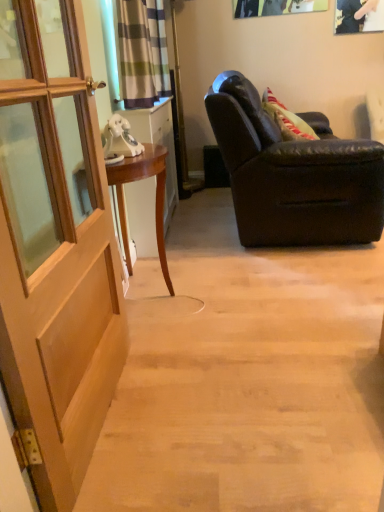
I want to click on vacant space behind light brown wood door at left, so click(x=173, y=344).